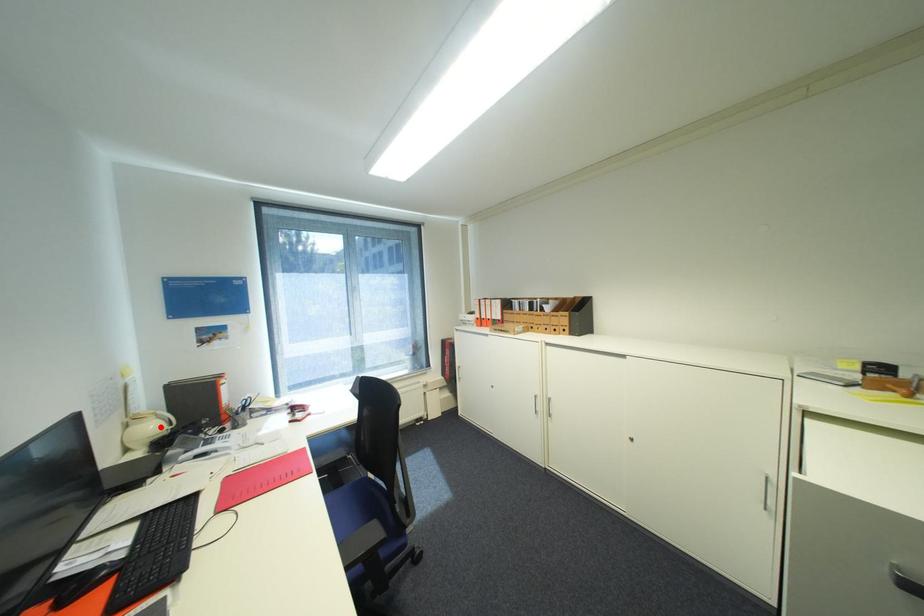
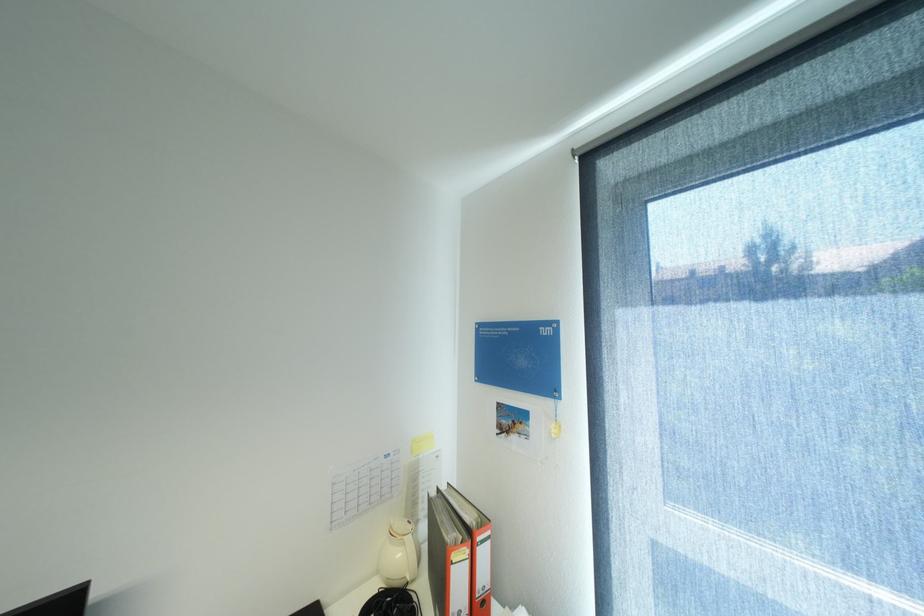
Locate, in the second image, the point that corresponds to the highlighted location in the first image.

(407, 554)